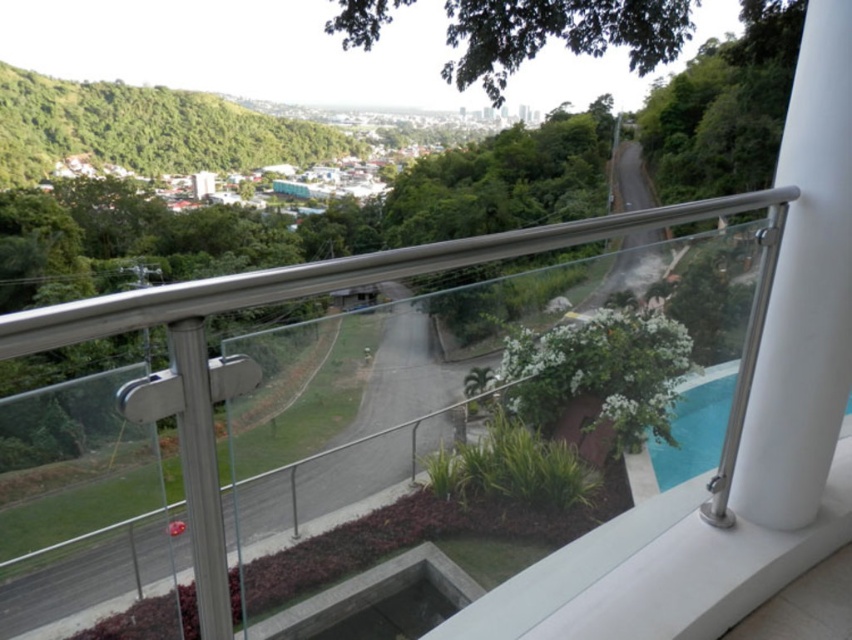
Question: Which of the following is the farthest from the observer?

Choices:
 (A) green leafy hillside at upper left
 (B) white glossy pillar at right

Answer: (A)

Question: Among these points, which one is nearest to the camera?

Choices:
 (A) (659, 442)
 (B) (438, 259)
 (C) (133, 147)

Answer: (B)

Question: Considering the real-world distances, which object is closest to the blue glass swimming pool at lower right?

Choices:
 (A) white glossy pillar at right
 (B) green leafy hillside at upper left

Answer: (A)

Question: Considering the relative positions of satin silver railing at upper center and blue glass swimming pool at lower right in the image provided, where is satin silver railing at upper center located with respect to blue glass swimming pool at lower right?

Choices:
 (A) above
 (B) below

Answer: (A)

Question: Can you confirm if white glossy pillar at right is bigger than satin silver railing at upper center?

Choices:
 (A) yes
 (B) no

Answer: (B)

Question: Can you confirm if white glossy pillar at right is thinner than satin silver railing at upper center?

Choices:
 (A) yes
 (B) no

Answer: (A)